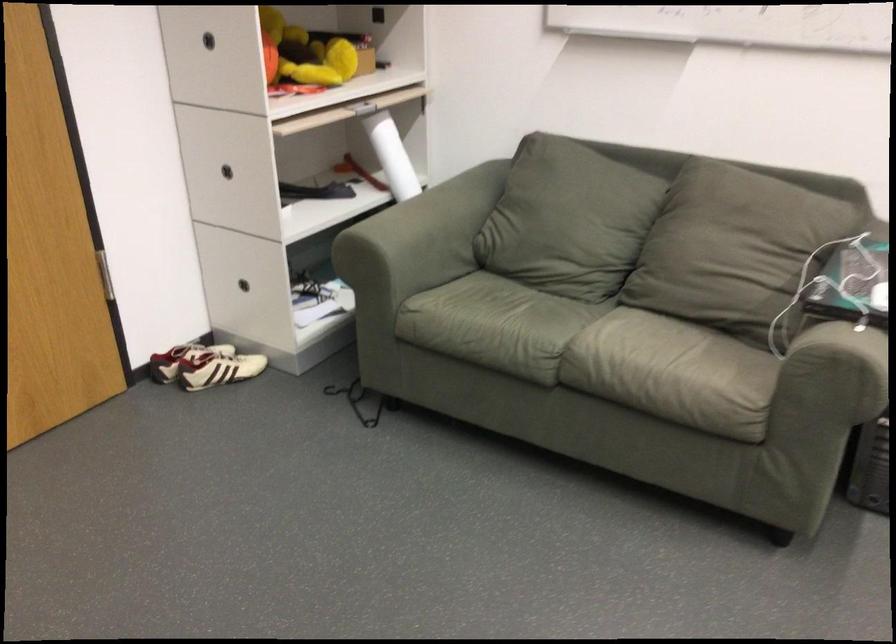
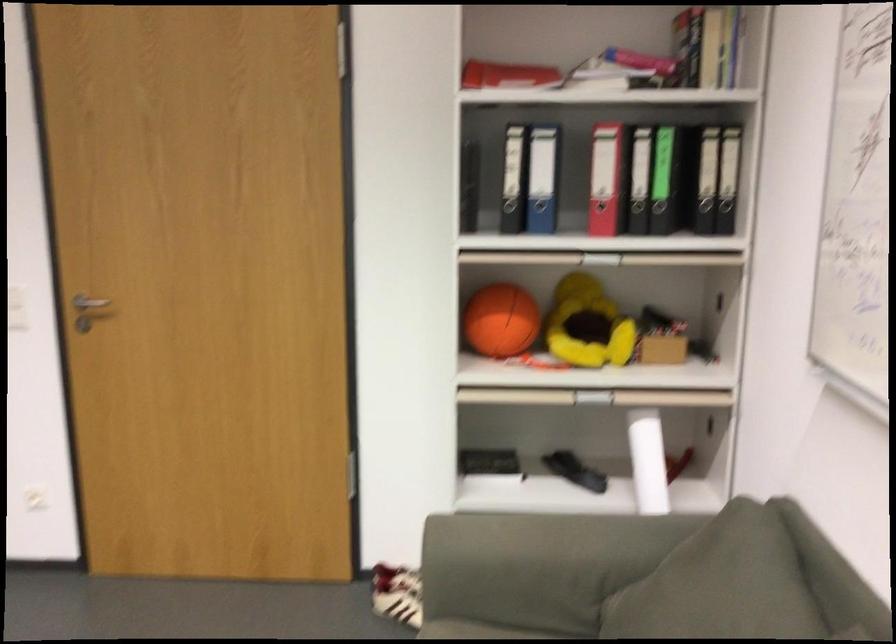
In the second image, find the point that corresponds to the point at 591,176 in the first image.

(747, 592)